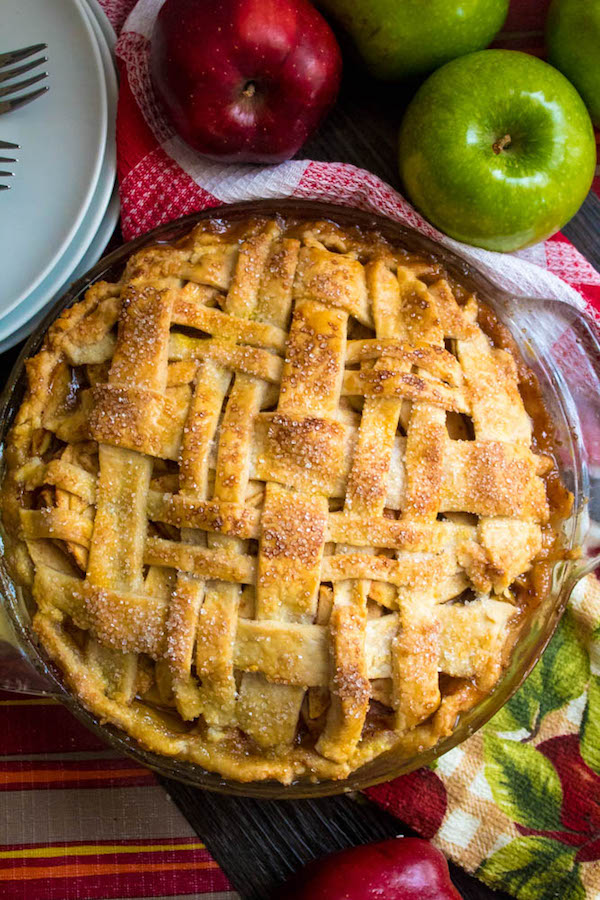
Identify the location of white saucers. (66, 204), (74, 61).